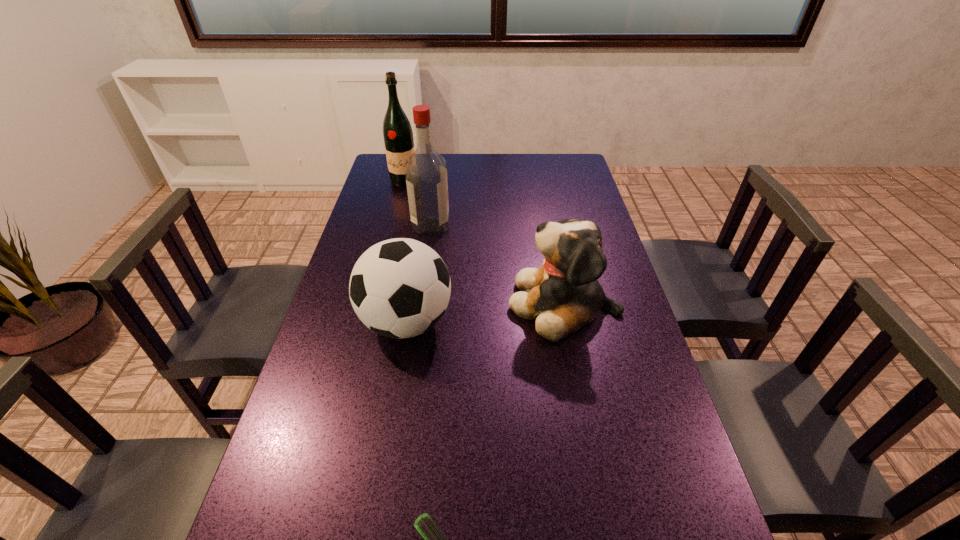
In the image, there is a desktop. Identify the location of vacant area at the far left corner. This screenshot has width=960, height=540. (385, 159).

Where is `empty location between the puppy and the right liquor`? Image resolution: width=960 pixels, height=540 pixels. empty location between the puppy and the right liquor is located at coordinates (497, 264).

Where is `unoccupied area between the soccer ball and the rightmost object`? The height and width of the screenshot is (540, 960). unoccupied area between the soccer ball and the rightmost object is located at coordinates (485, 313).

Identify the location of the second closest object to the soccer ball. (426, 174).

The width and height of the screenshot is (960, 540). Find the location of `object that is the third closest to the second farthest object`. object that is the third closest to the second farthest object is located at coordinates (399, 288).